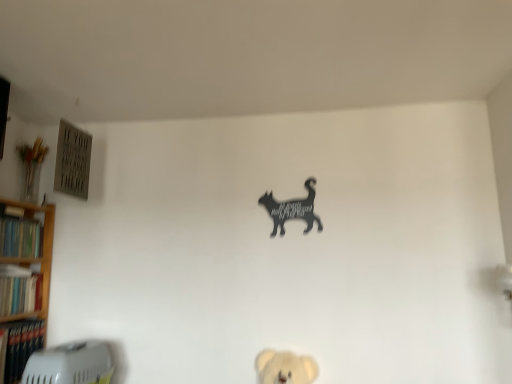
Question: Is black matte cat at upper center facing towards hardcover book at left, which ranks as the second book in top-to-bottom order?

Choices:
 (A) yes
 (B) no

Answer: (B)

Question: From a real-world perspective, is black matte cat at upper center physically above hardcover book at left, which ranks as the second book in top-to-bottom order?

Choices:
 (A) yes
 (B) no

Answer: (A)

Question: Is black matte cat at upper center thinner than hardcover book at left, the second book positioned from the bottom?

Choices:
 (A) yes
 (B) no

Answer: (A)

Question: Is black matte cat at upper center positioned beyond the bounds of hardcover book at left, the second book positioned from the bottom?

Choices:
 (A) yes
 (B) no

Answer: (A)

Question: Is black matte cat at upper center behind hardcover book at left, which ranks as the second book in top-to-bottom order?

Choices:
 (A) no
 (B) yes

Answer: (B)

Question: Considering their positions, is hardcover book at left, which ranks as the second book in top-to-bottom order, located in front of or behind hardcover book at left, which is counted as the third book, starting from the top?

Choices:
 (A) behind
 (B) front

Answer: (A)

Question: In terms of size, does hardcover book at left, which ranks as the second book in top-to-bottom order, appear bigger or smaller than hardcover book at left, which is the 1th book from bottom to top?

Choices:
 (A) small
 (B) big

Answer: (A)

Question: Looking at their shapes, would you say hardcover book at left, the second book positioned from the bottom, is wider or thinner than hardcover book at left, which is the 1th book from bottom to top?

Choices:
 (A) thin
 (B) wide

Answer: (B)

Question: From a real-world perspective, is hardcover book at left, which ranks as the second book in top-to-bottom order, physically located above or below hardcover book at left, which is the 1th book from bottom to top?

Choices:
 (A) above
 (B) below

Answer: (A)

Question: Considering the positions of wooden bookshelf at left and black matte cat at upper center in the image, is wooden bookshelf at left bigger or smaller than black matte cat at upper center?

Choices:
 (A) small
 (B) big

Answer: (B)

Question: Is point (11, 276) closer or farther from the camera than point (268, 196)?

Choices:
 (A) farther
 (B) closer

Answer: (B)

Question: Is wooden bookshelf at left to the left or to the right of black matte cat at upper center in the image?

Choices:
 (A) right
 (B) left

Answer: (B)

Question: Is wooden bookshelf at left wider or thinner than black matte cat at upper center?

Choices:
 (A) wide
 (B) thin

Answer: (A)

Question: Is point (7, 324) positioned closer to the camera than point (312, 196)?

Choices:
 (A) farther
 (B) closer

Answer: (B)

Question: Is hardcover book at left, which is the 1th book from bottom to top, bigger or smaller than black matte cat at upper center?

Choices:
 (A) small
 (B) big

Answer: (B)